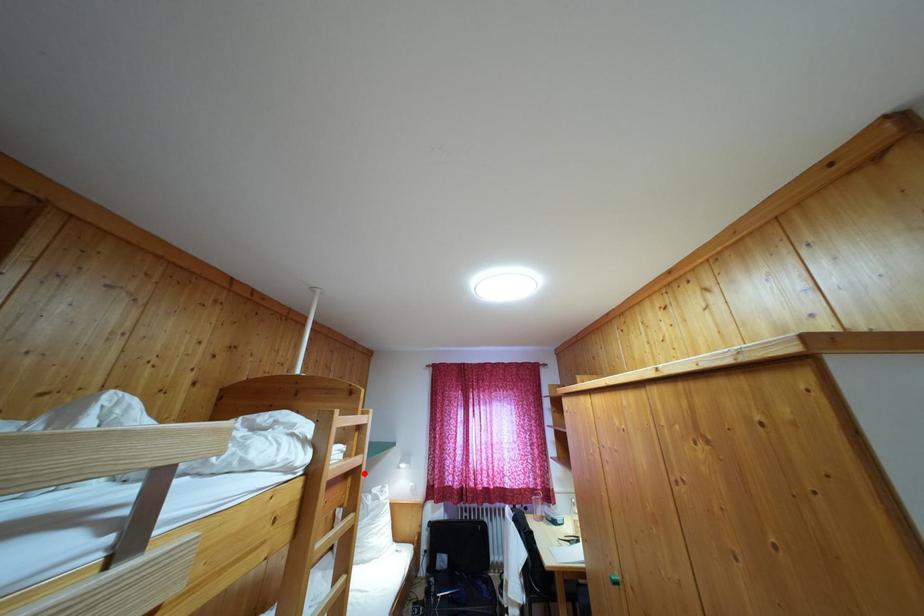
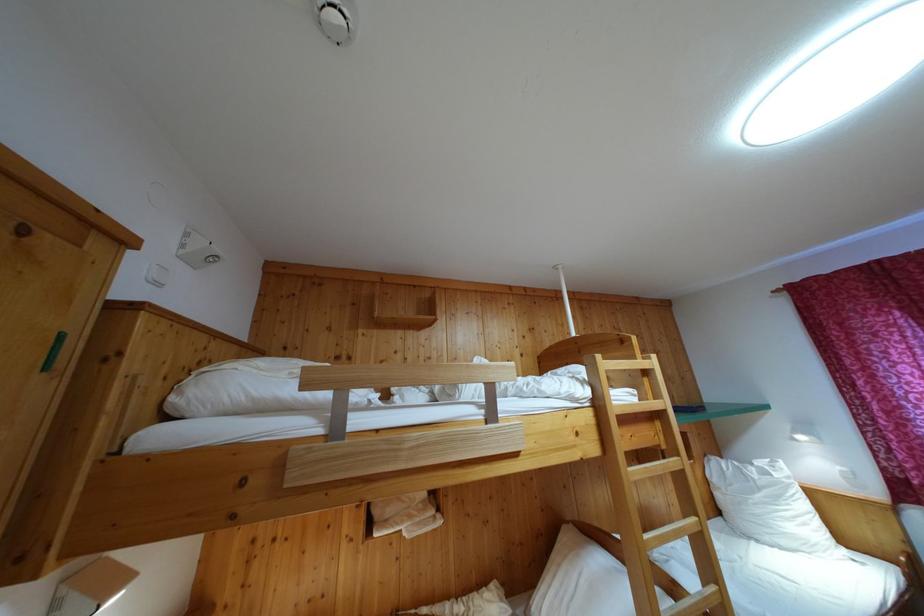
Question: I am providing you with two images of the same scene from different viewpoints. Image1 has a red point marked. In image2, the corresponding 3D location appears at what relative position? Reply with the corresponding letter.

Choices:
 (A) Closer
 (B) Farther

Answer: (B)